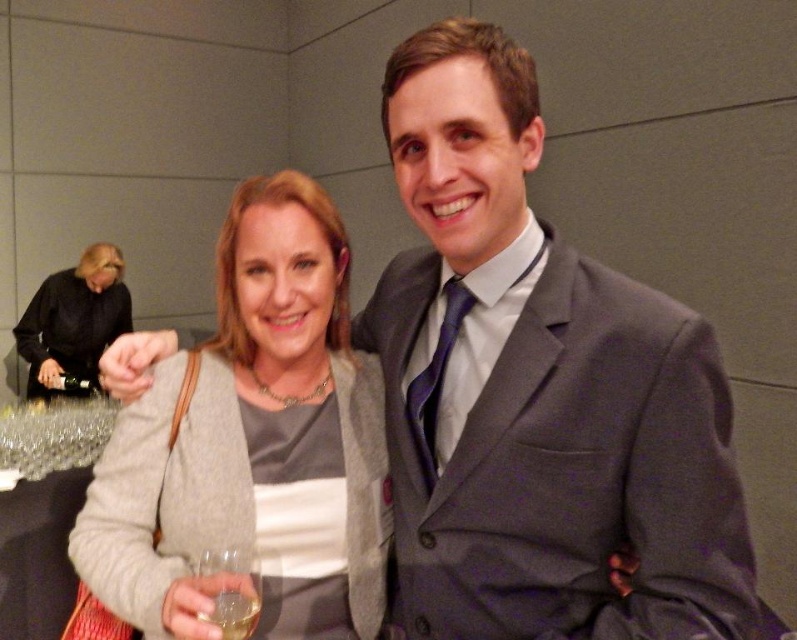
Does matte gray sweater at center have a larger size compared to clear glass wine at lower left?

Yes, matte gray sweater at center is bigger than clear glass wine at lower left.

How much distance is there between matte gray sweater at center and clear glass wine at lower left?

matte gray sweater at center is 13.70 inches away from clear glass wine at lower left.

Describe the element at coordinates (253, 442) in the screenshot. I see `matte gray sweater at center` at that location.

At what (x,y) coordinates should I click in order to perform the action: click on matte gray sweater at center. Please return your answer as a coordinate pair (x, y). The image size is (797, 640). Looking at the image, I should click on (253, 442).

Consider the image. Is matte gray sweater at center below black leather jacket at upper left?

Yes.

Is point (277, 262) closer to camera compared to point (93, 356)?

Yes, it is.

Where is `matte gray sweater at center`? This screenshot has width=797, height=640. matte gray sweater at center is located at coordinates (253, 442).

Which of these two, black leather jacket at upper left or clear glass wine at lower left, stands shorter?

clear glass wine at lower left

Who is more forward, (x=69, y=340) or (x=242, y=589)?

Point (x=242, y=589) is in front.

Does point (95, 253) lie in front of point (218, 600)?

No, it is not.

Find the location of `black leather jacket at upper left`. black leather jacket at upper left is located at coordinates (73, 323).